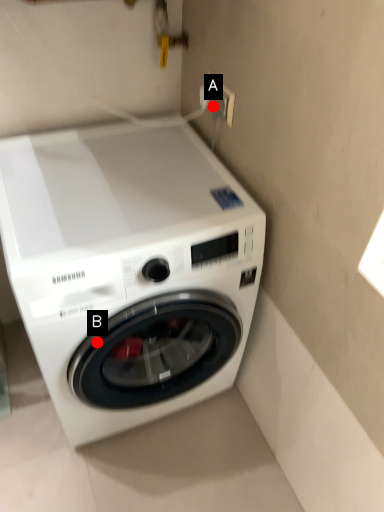
Question: Two points are circled on the image, labeled by A and B beside each circle. Among these points, which one is farthest from the camera?

Choices:
 (A) A is further
 (B) B is further

Answer: (A)